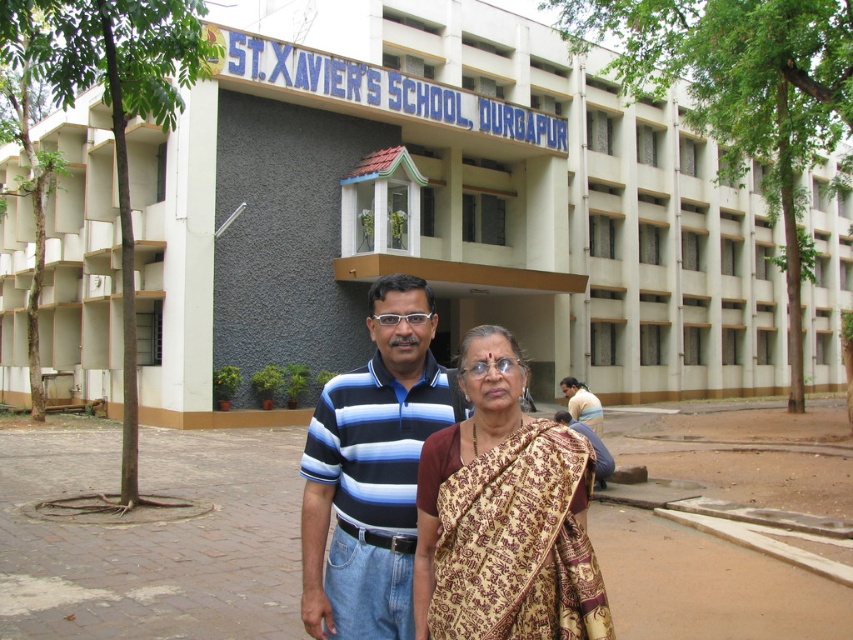
You are a visitor trying to locate the main entrance of ST. XAVIER SCHOOL, DURGAPUR. You see two points marked on the ground in front of the building. The first point is at coordinate point (451, 476) and the second is at point (582, 413). Which point is closer to the building?

Point (451, 476) is in front of point (582, 413), so the first point is closer to the building.